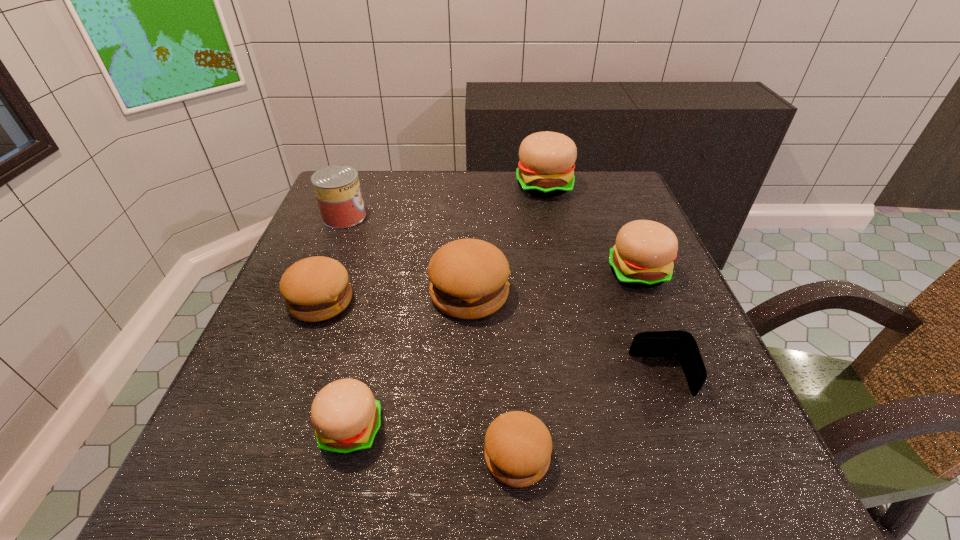
The width and height of the screenshot is (960, 540). Find the location of `beige hamburger identified as the second closest to the smallest beige hamburger`. beige hamburger identified as the second closest to the smallest beige hamburger is located at coordinates (546, 168).

Locate which brown hamburger is the second closest to the second farthest beige hamburger. Please provide its 2D coordinates. Your answer should be formatted as a tuple, i.e. [(x, y)], where the tuple contains the x and y coordinates of a point satisfying the conditions above.

[(518, 446)]

Select which brown hamburger appears as the second closest to the biggest beige hamburger. Please provide its 2D coordinates. Your answer should be formatted as a tuple, i.e. [(x, y)], where the tuple contains the x and y coordinates of a point satisfying the conditions above.

[(316, 288)]

You are a GUI agent. You are given a task and a screenshot of the screen. Output one action in this format:
    pyautogui.click(x=<x>, y=<y>)
    Task: Click on the free space that satisfies the following two spatial constraints: 1. on the back side of the can; 2. on the left side of the tallest hamburger
    This screenshot has width=960, height=540.
    Given the screenshot: What is the action you would take?
    pyautogui.click(x=356, y=186)

Locate an element on the screen. This screenshot has width=960, height=540. free space that satisfies the following two spatial constraints: 1. on the back side of the second nearest beige hamburger; 2. on the left side of the biggest brown hamburger is located at coordinates (470, 273).

You are a GUI agent. You are given a task and a screenshot of the screen. Output one action in this format:
    pyautogui.click(x=<x>, y=<y>)
    Task: Click on the free space that satisfies the following two spatial constraints: 1. on the front side of the biggest brown hamburger; 2. on the right side of the second farthest object
    The width and height of the screenshot is (960, 540).
    Given the screenshot: What is the action you would take?
    pyautogui.click(x=313, y=294)